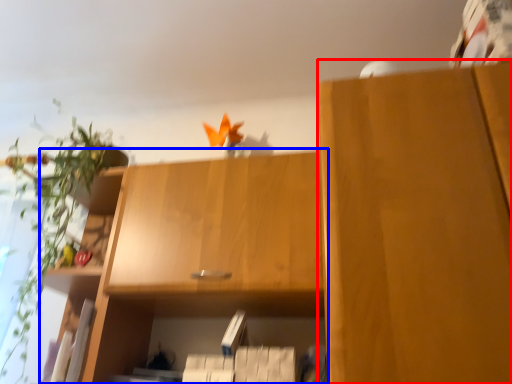
Question: Which of the following is the farthest to the observer, cabinetry (highlighted by a red box) or cabinetry (highlighted by a blue box)?

Choices:
 (A) cabinetry
 (B) cabinetry

Answer: (B)